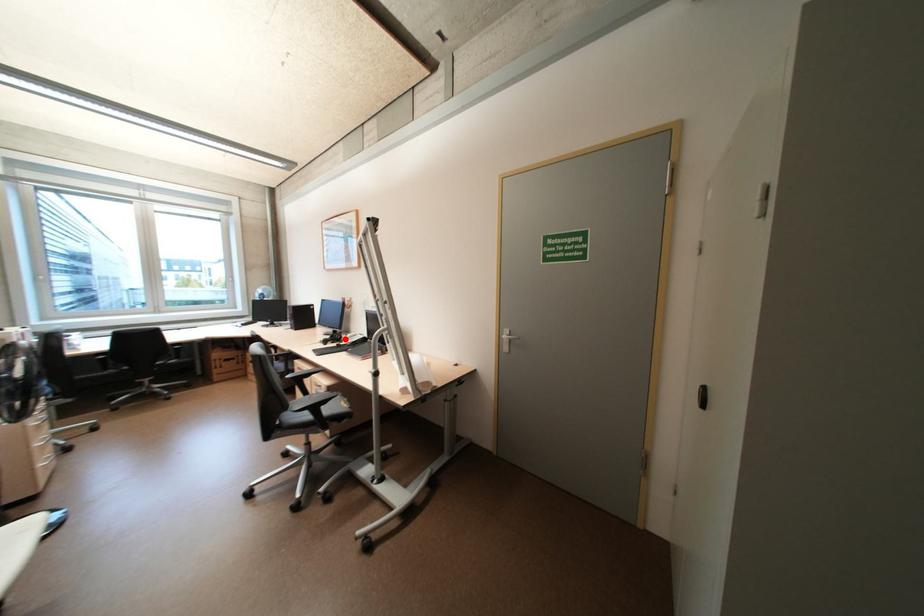
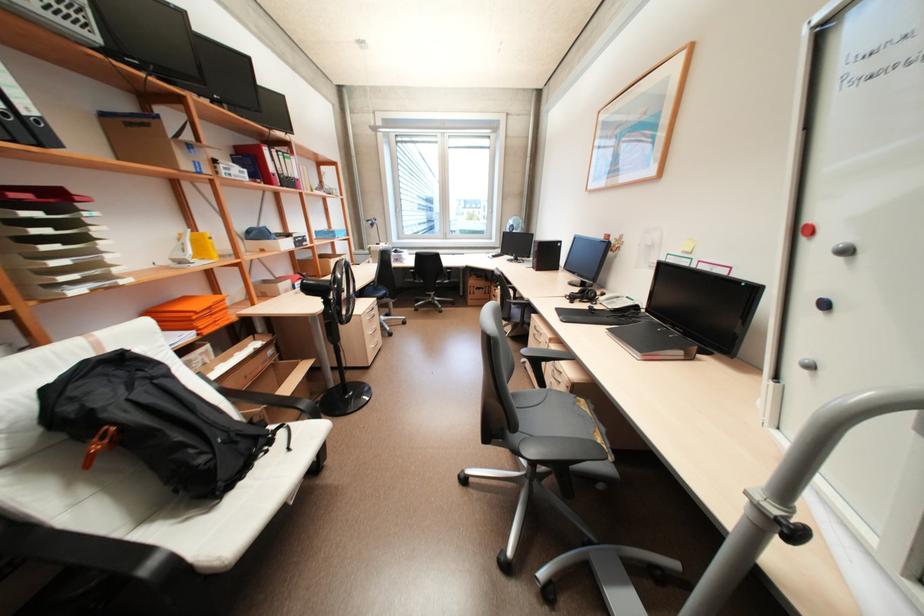
Question: I am providing you with two images of the same scene from different viewpoints. A red point is shown in image1. For the corresponding object point in image2, is it positioned nearer or farther from the camera?

Choices:
 (A) Nearer
 (B) Farther

Answer: (A)